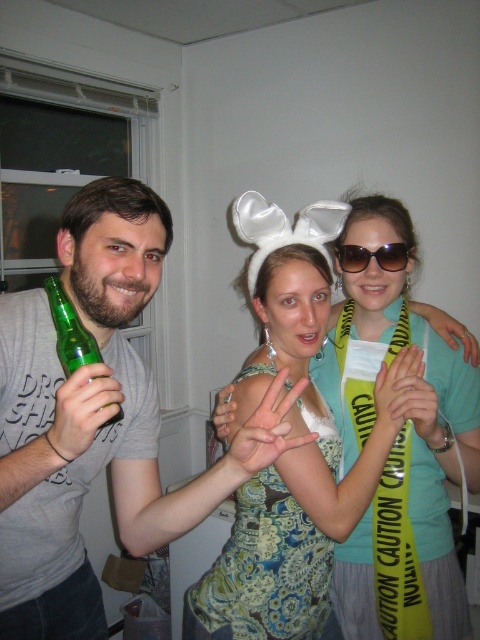
Does gray cotton t-shirt at left appear over floral dress at center?

No.

Who is shorter, gray cotton t-shirt at left or floral dress at center?

Standing shorter between the two is gray cotton t-shirt at left.

The image size is (480, 640). In order to click on gray cotton t-shirt at left in this screenshot , I will do `click(96, 420)`.

Is floral dress at center below sunglasses at center?

Indeed, floral dress at center is positioned under sunglasses at center.

Does floral dress at center have a lesser width compared to sunglasses at center?

No.

Between point (380, 211) and point (397, 262), which one is positioned in front?

Point (397, 262) is in front.

Locate an element on the screen. floral dress at center is located at coordinates (398, 448).

Between gray cotton t-shirt at left and green glass bottle at left, which one is positioned lower?

gray cotton t-shirt at left is lower down.

Who is positioned more to the left, gray cotton t-shirt at left or green glass bottle at left?

green glass bottle at left is more to the left.

Locate an element on the screen. This screenshot has width=480, height=640. gray cotton t-shirt at left is located at coordinates (96, 420).